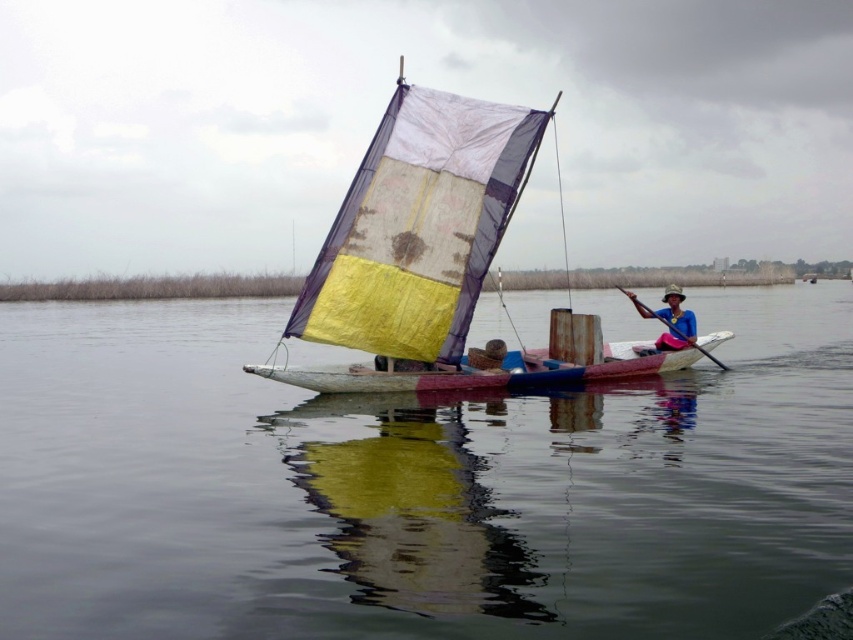
Between yellow fabric sailboat at center and wooden smooth paddle at center, which one has more height?

Standing taller between the two is yellow fabric sailboat at center.

Between yellow fabric sailboat at center and wooden smooth paddle at center, which one appears on the left side from the viewer's perspective?

From the viewer's perspective, wooden smooth paddle at center appears more on the left side.

This screenshot has height=640, width=853. What are the coordinates of `yellow fabric sailboat at center` in the screenshot? It's located at (440, 262).

Is point (677, 337) more distant than point (705, 349)?

No, (677, 337) is closer to viewer.

Is blue fabric hat at center wider than wooden smooth paddle at center?

No, blue fabric hat at center is not wider than wooden smooth paddle at center.

Who is more forward, (636,301) or (621,289)?

Point (621,289) is in front.

Find the location of a particular element. blue fabric hat at center is located at coordinates (670, 320).

Who is more forward, [769,332] or [665,337]?

Point [665,337] is more forward.

Measure the distance from transparent water at center to blue fabric hat at center.

The distance of transparent water at center from blue fabric hat at center is 10.51 meters.

Between point (289, 465) and point (666, 316), which one is positioned in front?

Point (289, 465)

The width and height of the screenshot is (853, 640). I want to click on transparent water at center, so click(415, 484).